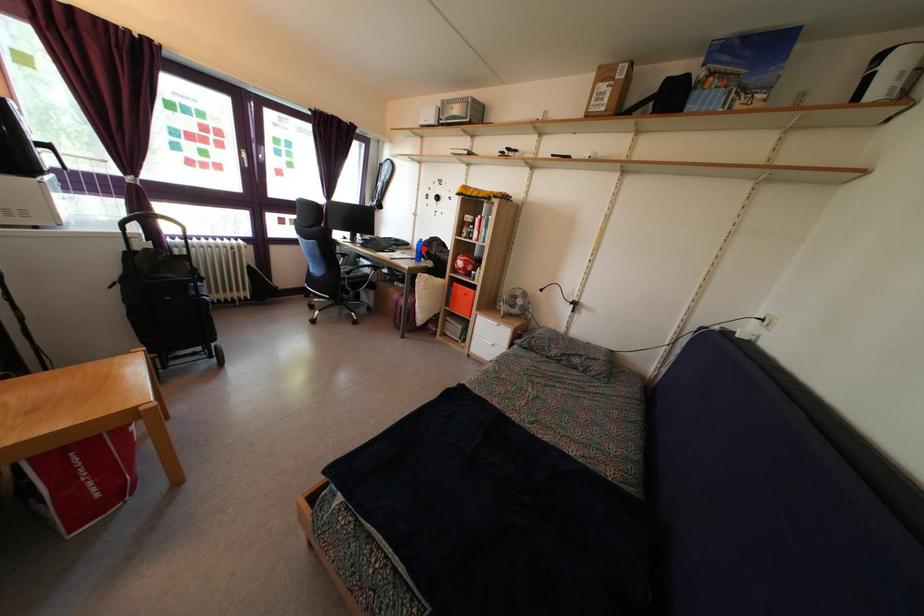
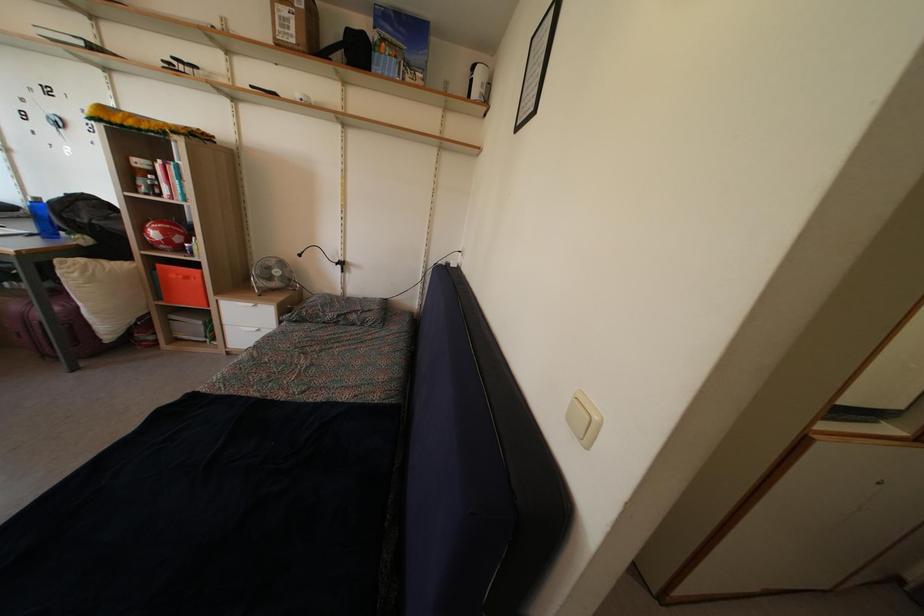
The point at the highlighted location is marked in the first image. Where is the corresponding point in the second image?

(40, 208)